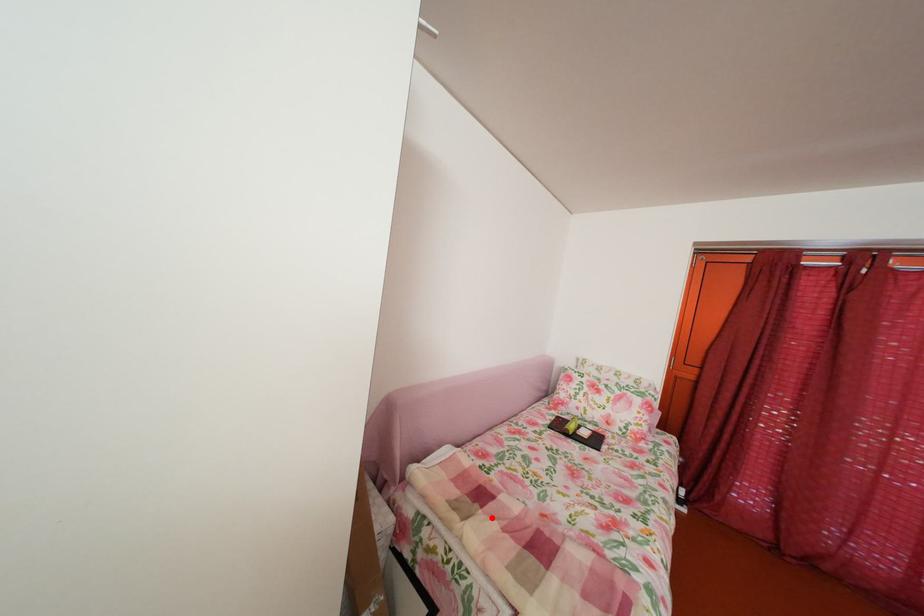
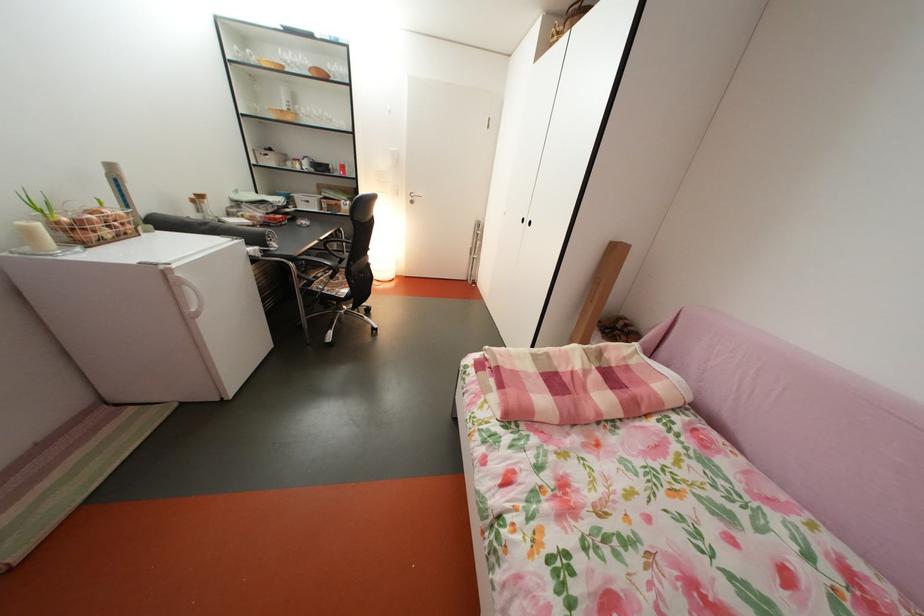
Locate, in the second image, the point that corresponds to the highlighted location in the first image.

(604, 374)